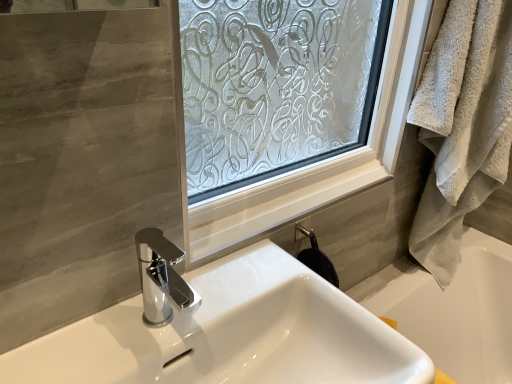
Question: Is point (483, 357) closer or farther from the camera than point (240, 273)?

Choices:
 (A) farther
 (B) closer

Answer: (A)

Question: In terms of width, does white glossy bathtub at lower right look wider or thinner when compared to white glossy sink at center?

Choices:
 (A) thin
 (B) wide

Answer: (A)

Question: Based on their relative distances, which object is nearer to the beige fluffy towel at right?

Choices:
 (A) white glossy sink at center
 (B) white glossy bathtub at lower right

Answer: (B)

Question: Which of these objects is positioned farthest from the white glossy sink at center?

Choices:
 (A) white glossy bathtub at lower right
 (B) beige fluffy towel at right

Answer: (A)